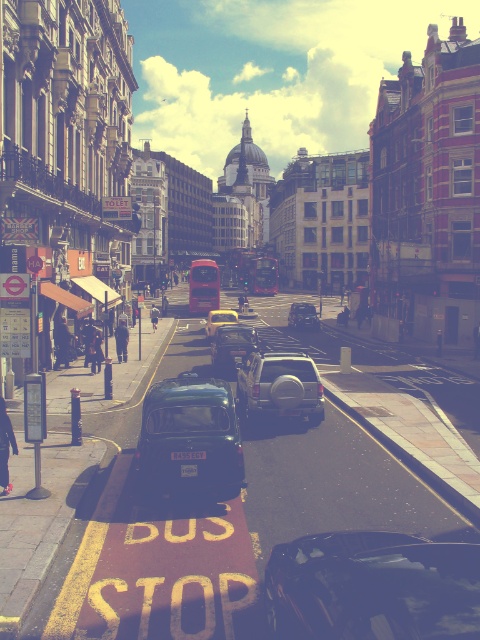
Consider the image. You are a pedestrian standing at the bus stop and see the glossy black car at center and the white plastic license plate at center. Which object is positioned more to the right?

The glossy black car at center is positioned to the right of the white plastic license plate at center, so the glossy black car at center is more to the right.

You are a photographer standing at the bus stop. You want to take a photo of the glossy black car at center and the white plastic license plate at center. Which object will appear larger in your photo?

The glossy black car at center will appear larger in the photo because it is closer to the viewer than the white plastic license plate at center.